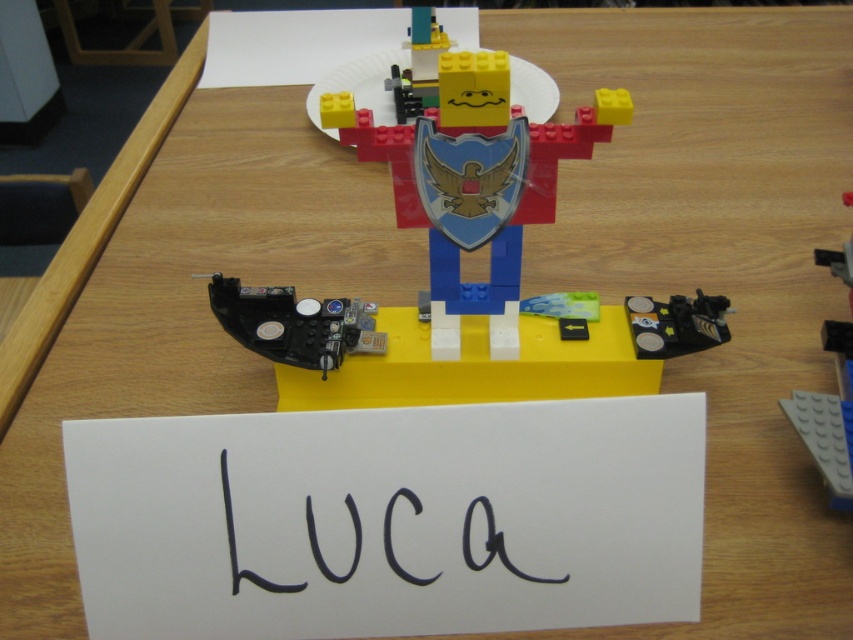
Question: Which object is positioned farthest from the yellow matte lego head at upper center?

Choices:
 (A) matte plastic figure at center
 (B) black plastic control panel at lower center
 (C) black ink writing at center

Answer: (C)

Question: Can you confirm if black plastic control panel at lower center is positioned to the right of gray plastic plate at upper center?

Choices:
 (A) yes
 (B) no

Answer: (B)

Question: Can you confirm if metallic black and silver at lower right is positioned to the left of yellow matte lego head at upper center?

Choices:
 (A) no
 (B) yes

Answer: (A)

Question: From the image, what is the correct spatial relationship of matte plastic figure at center in relation to gray plastic plate at upper center?

Choices:
 (A) right
 (B) left

Answer: (B)

Question: Which point appears closest to the camera in this image?

Choices:
 (A) (311, 326)
 (B) (376, 339)
 (C) (425, 29)
 (D) (648, 301)

Answer: (B)

Question: Which point is farther from the camera taking this photo?

Choices:
 (A) (438, 125)
 (B) (299, 358)
 (C) (682, 353)

Answer: (C)